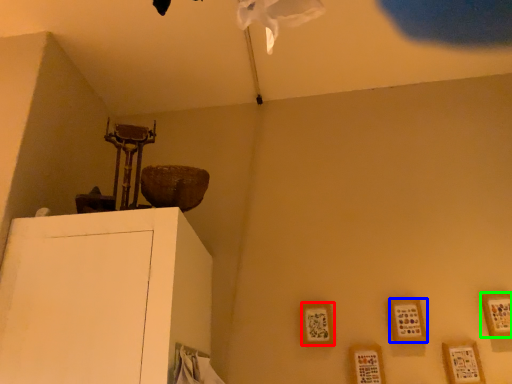
Question: Based on their relative distances, which object is nearer to picture frame (highlighted by a red box)? Choose from picture frame (highlighted by a blue box) and picture frame (highlighted by a green box).

Choices:
 (A) picture frame
 (B) picture frame

Answer: (A)